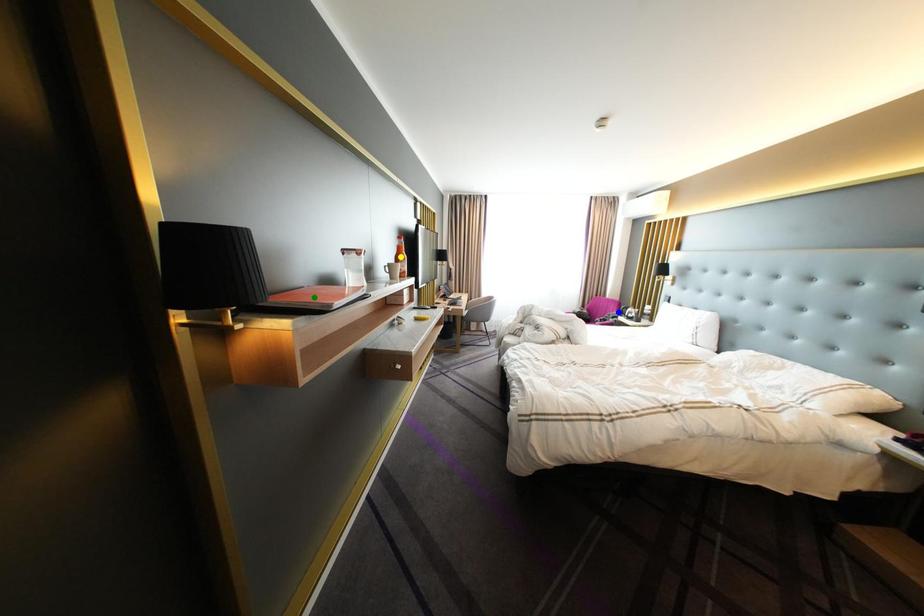
Order these from nearest to farthest:
1. green point
2. yellow point
3. blue point

green point < yellow point < blue point